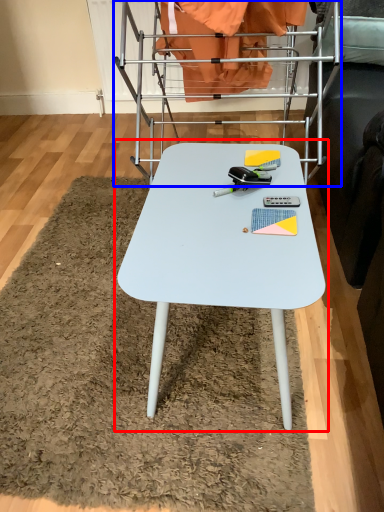
Question: Which object is further to the camera taking this photo, table (highlighted by a red box) or bunk bed (highlighted by a blue box)?

Choices:
 (A) table
 (B) bunk bed

Answer: (B)